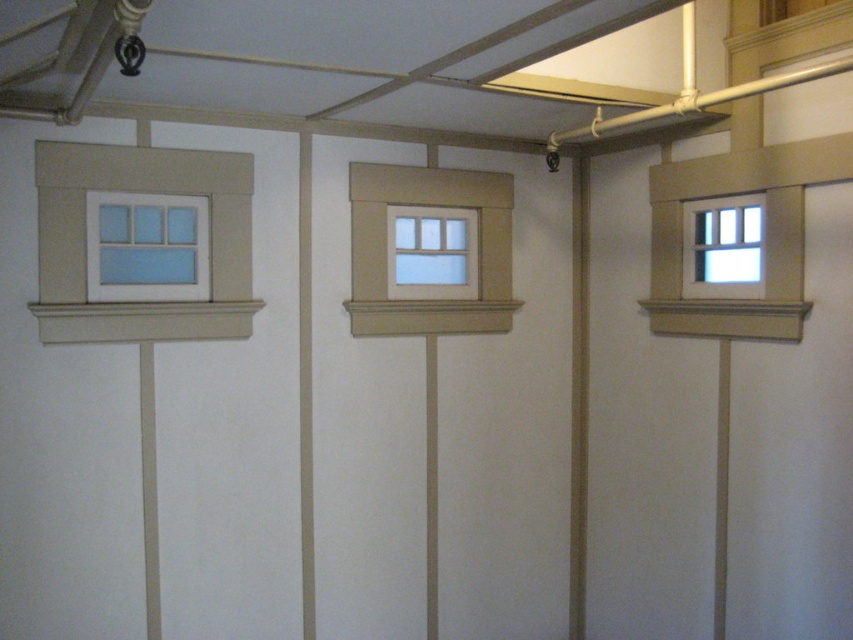
Does matte white wood window at center have a greater height compared to white painted wood window at upper left?

Yes, matte white wood window at center is taller than white painted wood window at upper left.

Based on the photo, how far apart are matte white wood window at center and white painted wood window at upper left?

matte white wood window at center and white painted wood window at upper left are 28.71 inches apart from each other.

Is point (450, 321) behind point (138, 259)?

Yes, point (450, 321) is behind point (138, 259).

What are the coordinates of `matte white wood window at center` in the screenshot? It's located at (386, 248).

Can you confirm if matte beige window frame at left is positioned to the right of white painted wood window at right?

No, matte beige window frame at left is not to the right of white painted wood window at right.

Between point (99, 332) and point (717, 256), which one is positioned behind?

The point (717, 256) is behind.

Where is `matte beige window frame at left`? matte beige window frame at left is located at coordinates (144, 193).

Who is lower down, matte beige window frame at left or white painted wood window at upper left?

Positioned lower is white painted wood window at upper left.

Who is more distant from viewer, (73, 221) or (131, 285)?

The point (131, 285) is behind.

In order to click on matte beige window frame at left in this screenshot , I will do `click(144, 193)`.